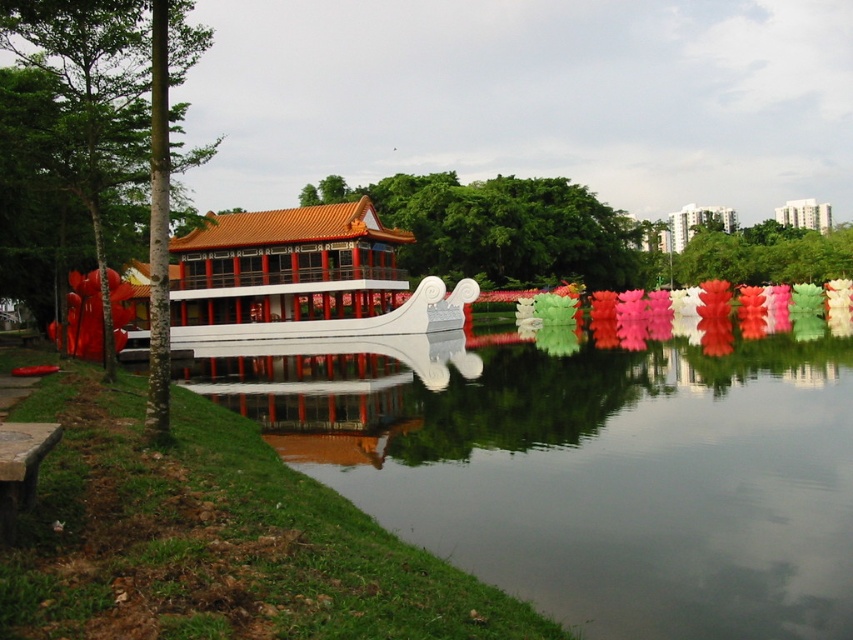
Which of these two, white glossy boat at center or white glossy building at upper right, stands shorter?

white glossy boat at center

Image resolution: width=853 pixels, height=640 pixels. What do you see at coordinates (303, 278) in the screenshot? I see `white glossy boat at center` at bounding box center [303, 278].

Is point (259, 269) farther from viewer compared to point (816, 204)?

No.

I want to click on white glossy boat at center, so click(303, 278).

Does green leafy tree at center appear on the right side of white glossy building at upper right?

Incorrect, green leafy tree at center is not on the right side of white glossy building at upper right.

Describe the element at coordinates (503, 228) in the screenshot. I see `green leafy tree at center` at that location.

Identify the location of green leafy tree at center. The height and width of the screenshot is (640, 853). (503, 228).

Can you confirm if white glossy boat at center is positioned below matte orange temple at upper center?

Yes, white glossy boat at center is below matte orange temple at upper center.

This screenshot has height=640, width=853. What are the coordinates of `white glossy boat at center` in the screenshot? It's located at (303, 278).

This screenshot has height=640, width=853. Identify the location of white glossy boat at center. (303, 278).